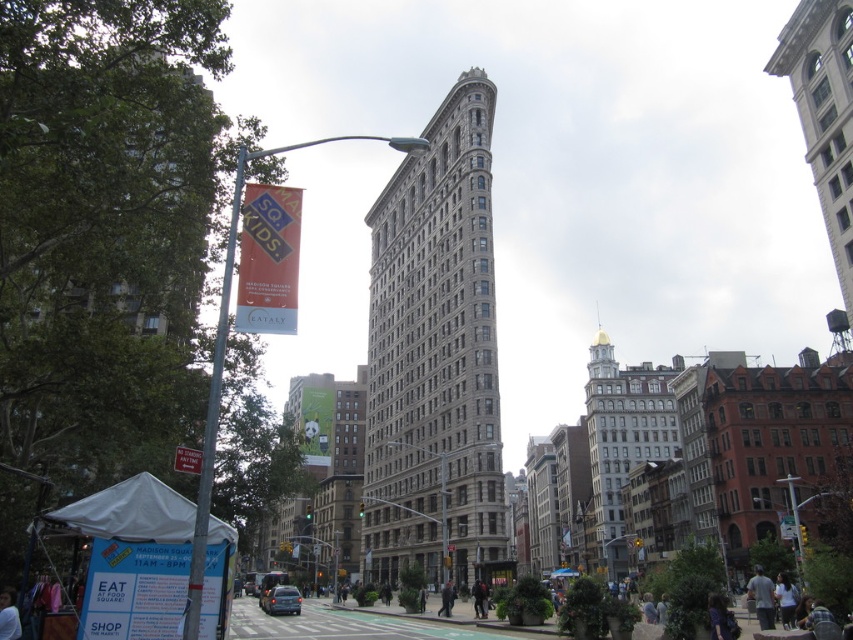
What do you see at coordinates (434, 355) in the screenshot? I see `gray stone building at center` at bounding box center [434, 355].

Can you confirm if gray stone building at center is wider than metallic pole at left?

In fact, gray stone building at center might be narrower than metallic pole at left.

Find the location of `gray stone building at center`. gray stone building at center is located at coordinates [x=434, y=355].

Which is below, gray stone building at center or dark gray jacket at lower center?

dark gray jacket at lower center is below.

This screenshot has height=640, width=853. What are the coordinates of `gray stone building at center` in the screenshot? It's located at (434, 355).

Describe the element at coordinates (434, 355) in the screenshot. I see `gray stone building at center` at that location.

This screenshot has height=640, width=853. I want to click on gray stone building at center, so click(x=434, y=355).

Between white stone bell tower at upper right and metallic pole at left, which one is positioned higher?

Positioned higher is white stone bell tower at upper right.

Who is shorter, white stone bell tower at upper right or metallic pole at left?

metallic pole at left is shorter.

Locate an element on the screen. The width and height of the screenshot is (853, 640). white stone bell tower at upper right is located at coordinates (824, 115).